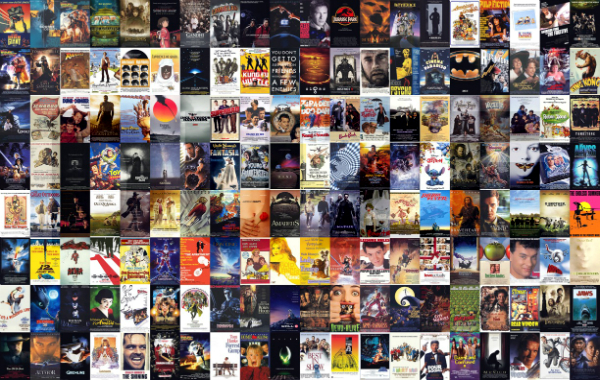
Find the location of a particular element. The width and height of the screenshot is (600, 380). rows of movies is located at coordinates (15, 22), (13, 64), (16, 122), (14, 165), (13, 210), (14, 263), (15, 308), (14, 352).